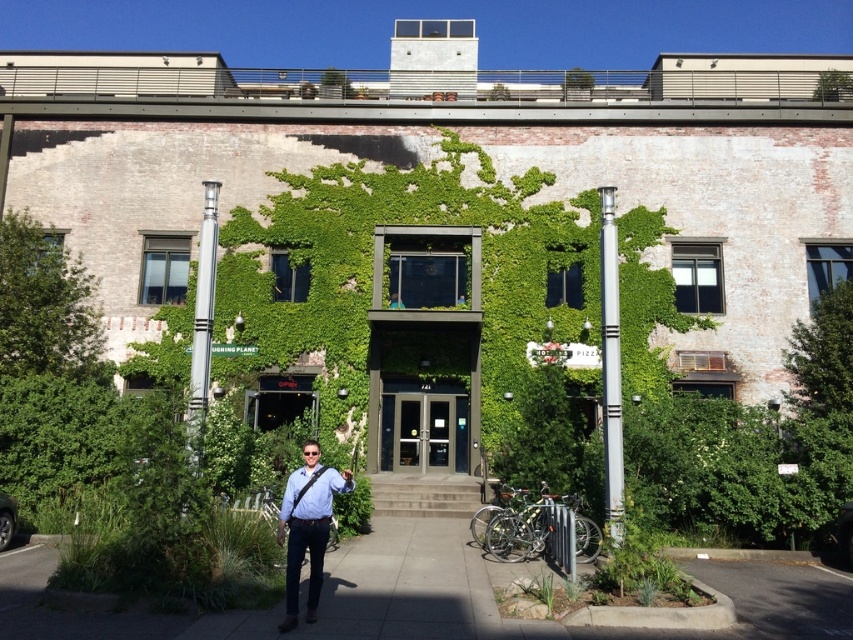
Question: Based on their relative distances, which object is nearer to the matte glass doors at center?

Choices:
 (A) silver metallic pole at center-left
 (B) matte blue shirt at center
 (C) silver metallic pole at center-right

Answer: (C)

Question: Does matte glass doors at center have a smaller size compared to silver metallic pole at center-right?

Choices:
 (A) no
 (B) yes

Answer: (A)

Question: Which is farther from the silver metallic pole at center-left?

Choices:
 (A) matte blue shirt at center
 (B) silver metallic pole at center-right

Answer: (B)

Question: Which object is closer to the camera taking this photo?

Choices:
 (A) gray concrete sidewalk at center
 (B) silver metallic pole at center-right
 (C) matte glass doors at center
 (D) silver metallic pole at center-left

Answer: (A)

Question: Is matte glass doors at center to the right of silver metallic pole at center-left from the viewer's perspective?

Choices:
 (A) yes
 (B) no

Answer: (A)

Question: Is gray concrete sidewalk at center to the left of matte glass doors at center from the viewer's perspective?

Choices:
 (A) yes
 (B) no

Answer: (B)